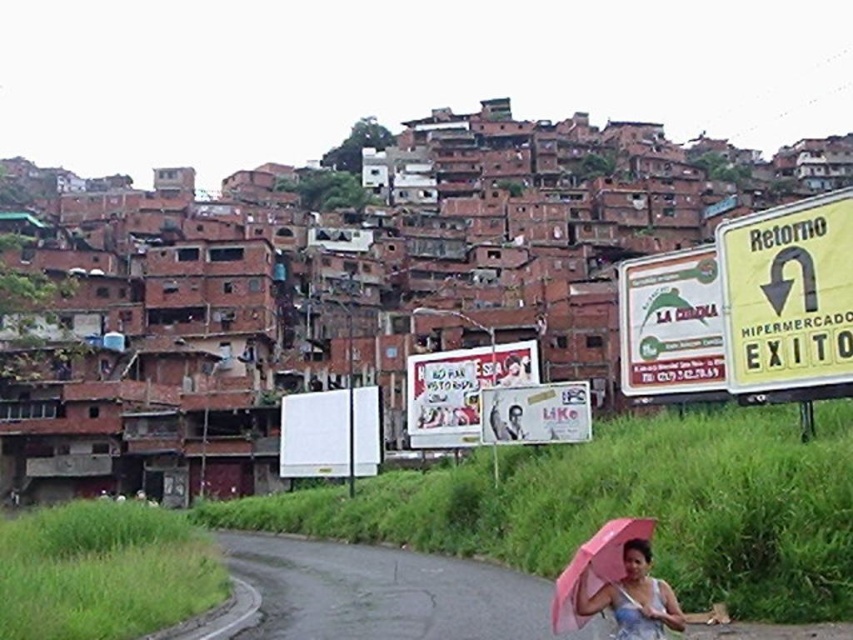
Can you confirm if brown brick houses at upper left is shorter than pink matte umbrella at lower right?

No.

Does brown brick houses at upper left have a greater height compared to pink matte umbrella at lower right?

Yes, brown brick houses at upper left is taller than pink matte umbrella at lower right.

Locate an element on the screen. brown brick houses at upper left is located at coordinates (625, 506).

This screenshot has height=640, width=853. Find the location of `brown brick houses at upper left`. brown brick houses at upper left is located at coordinates (625, 506).